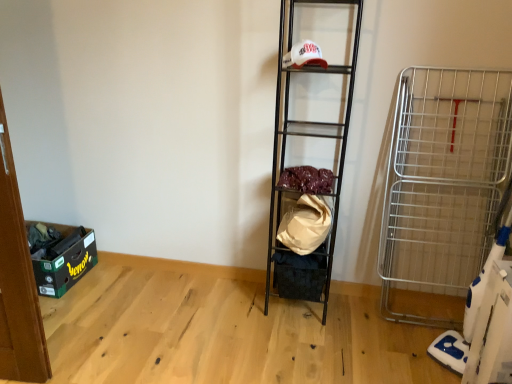
The image size is (512, 384). In order to click on vacant space in between silver metallic cart at right and metallic black shelf at center in this screenshot , I will do `click(375, 330)`.